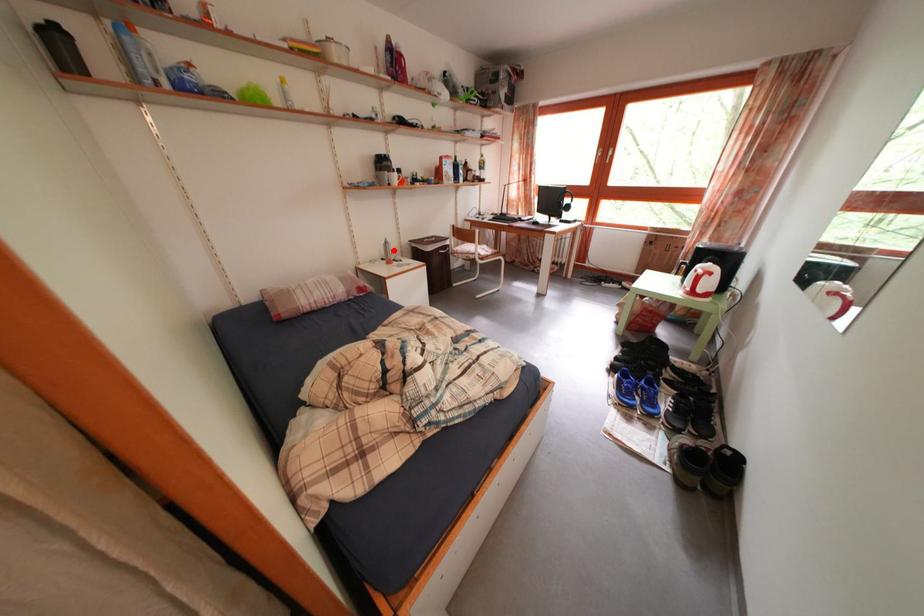
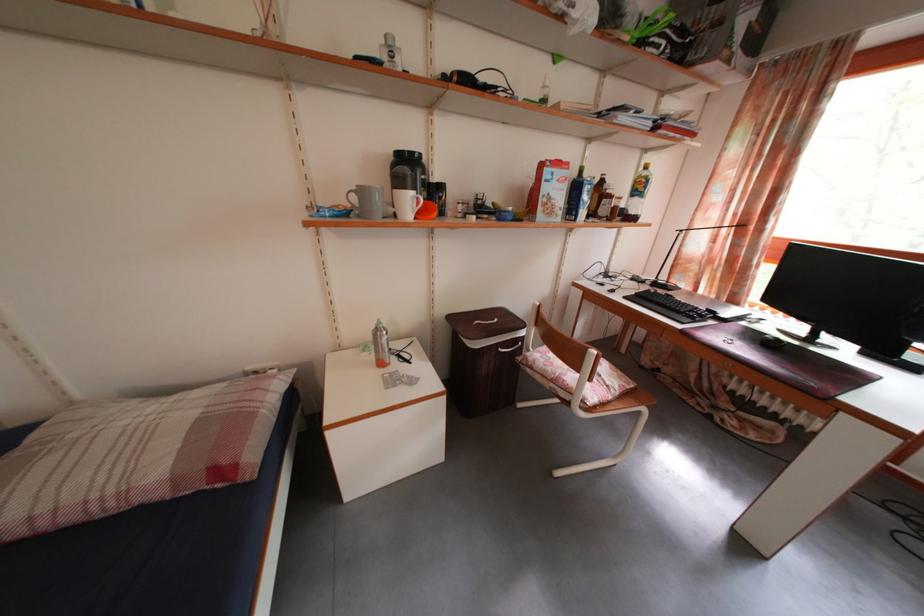
Find the pixel in the second image that matches the highlighted location in the first image.

(384, 338)